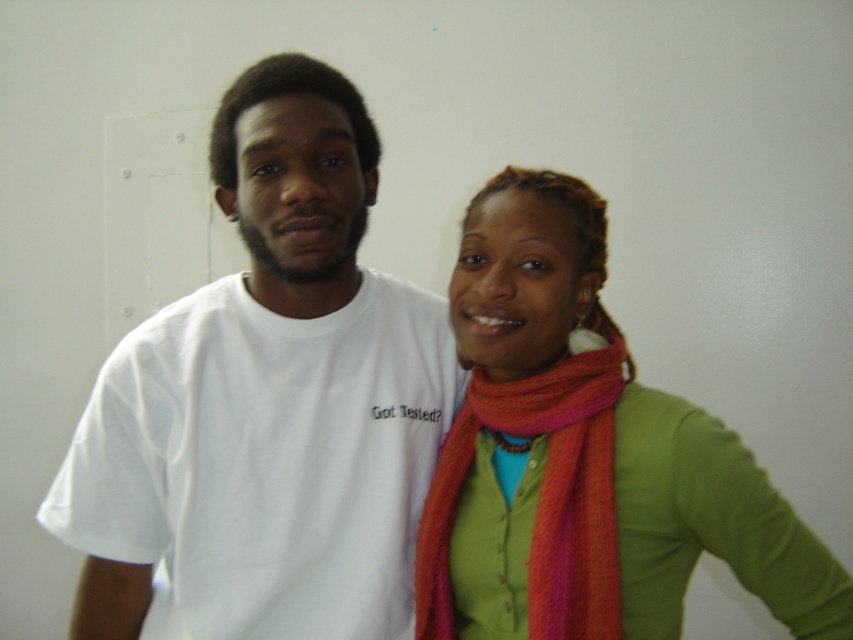
Question: Is green matte scarf at center above orange woolen scarf at center?

Choices:
 (A) yes
 (B) no

Answer: (A)

Question: Among these points, which one is farthest from the camera?

Choices:
 (A) (567, 408)
 (B) (134, 589)
 (C) (543, 410)

Answer: (B)

Question: Which object is closer to the camera taking this photo?

Choices:
 (A) white cotton t-shirt at left
 (B) green matte scarf at center
 (C) orange woolen scarf at center

Answer: (B)

Question: Does white cotton t-shirt at left have a larger size compared to green matte scarf at center?

Choices:
 (A) no
 (B) yes

Answer: (B)

Question: Can you confirm if white cotton t-shirt at left is thinner than green matte scarf at center?

Choices:
 (A) yes
 (B) no

Answer: (B)

Question: Which object is closer to the camera taking this photo?

Choices:
 (A) green matte scarf at center
 (B) orange woolen scarf at center
 (C) white cotton t-shirt at left

Answer: (A)